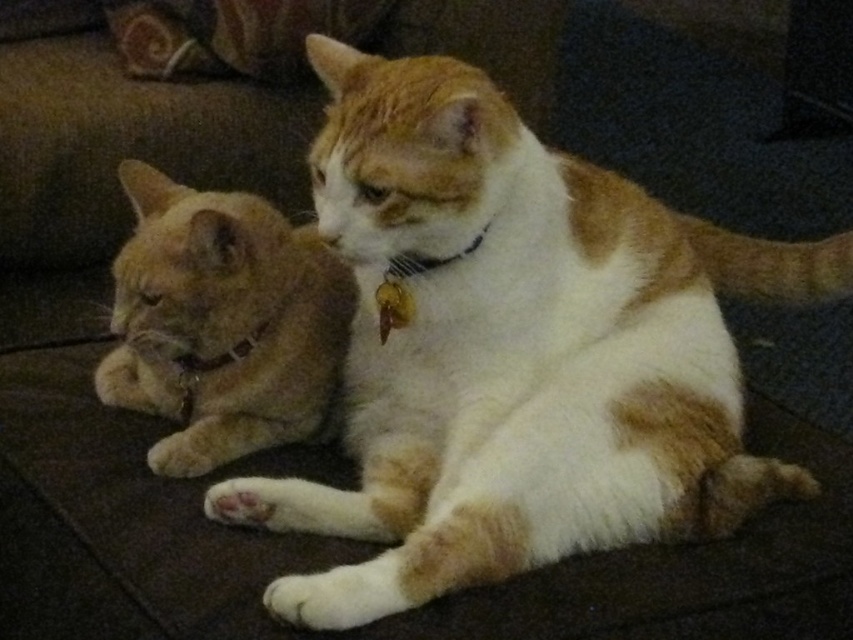
Question: Among these objects, which one is nearest to the camera?

Choices:
 (A) white fur cat at center
 (B) orange fur cat at left

Answer: (A)

Question: Is white fur cat at center wider than orange fur cat at left?

Choices:
 (A) yes
 (B) no

Answer: (A)

Question: Does white fur cat at center appear over orange fur cat at left?

Choices:
 (A) no
 (B) yes

Answer: (B)

Question: Which point appears farthest from the camera in this image?

Choices:
 (A) (308, 353)
 (B) (347, 576)

Answer: (A)

Question: Does white fur cat at center have a lesser width compared to orange fur cat at left?

Choices:
 (A) no
 (B) yes

Answer: (A)